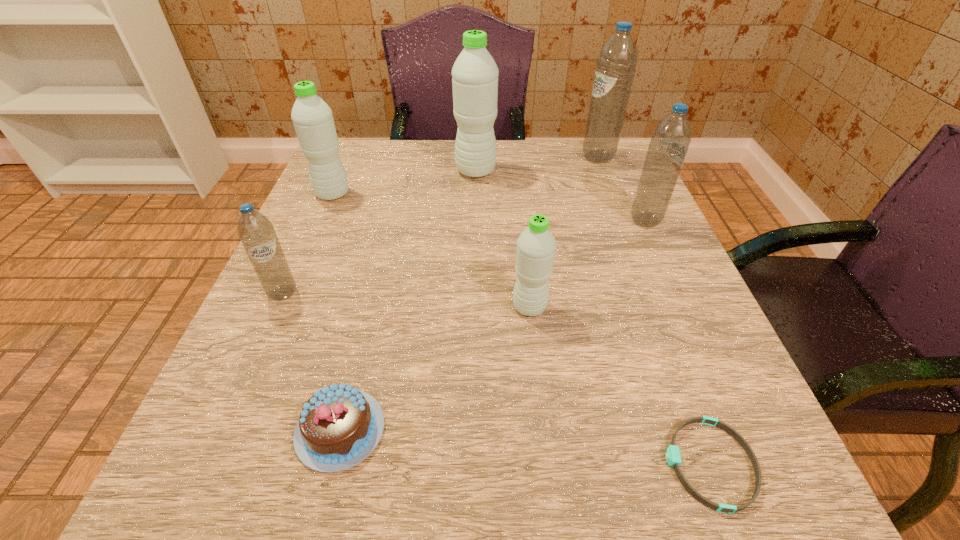
Find the location of a particular element. The height and width of the screenshot is (540, 960). object present at the near left corner is located at coordinates (339, 426).

The image size is (960, 540). I want to click on object present at the far right corner, so click(x=616, y=63).

This screenshot has width=960, height=540. I want to click on object at the near right corner, so click(x=673, y=457).

In the image, there is a desktop. Identify the location of vacant space at the far edge. (428, 176).

In the image, there is a desktop. Identify the location of vacant space at the near edge. (488, 500).

Image resolution: width=960 pixels, height=540 pixels. In order to click on vacant area at the left edge of the desktop in this screenshot , I will do point(328,211).

Identify the location of vacant space at the far left corner of the desktop. The image size is (960, 540). 367,183.

In the image, there is a desktop. At what (x,y) coordinates should I click in order to perform the action: click on blank space at the far right corner. Please return your answer as a coordinate pair (x, y). Image resolution: width=960 pixels, height=540 pixels. Looking at the image, I should click on (591, 165).

At what (x,y) coordinates should I click in order to perform the action: click on unoccupied area between the second green water bottle from right to left and the second biggest blue water bottle. Please return your answer as a coordinate pair (x, y). Image resolution: width=960 pixels, height=540 pixels. Looking at the image, I should click on (561, 196).

Where is `free space between the farthest blue water bottle and the second shortest object`? This screenshot has height=540, width=960. free space between the farthest blue water bottle and the second shortest object is located at coordinates (469, 294).